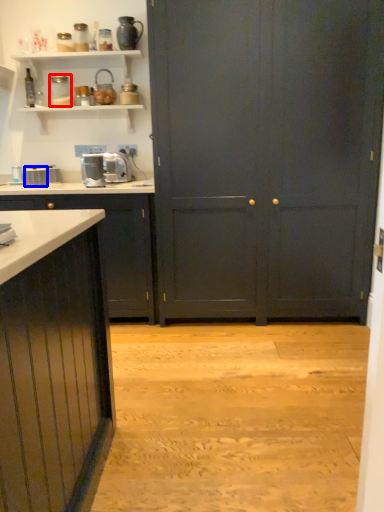
Question: Which object is closer to the camera taking this photo, appliance (highlighted by a red box) or appliance (highlighted by a blue box)?

Choices:
 (A) appliance
 (B) appliance

Answer: (B)